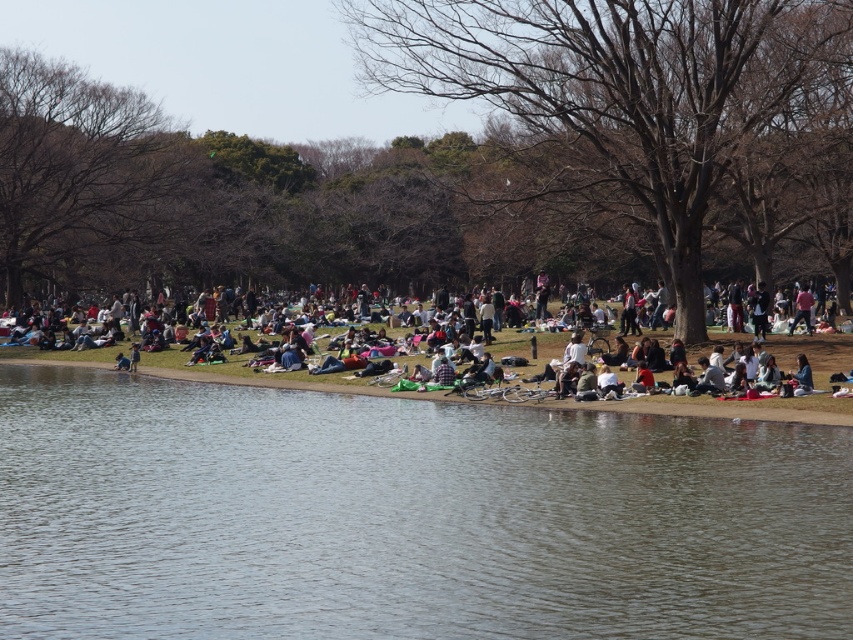
Question: Can you confirm if clear water at lower center is positioned above light brown fabric picnic blanket at center?

Choices:
 (A) no
 (B) yes

Answer: (A)

Question: Which object appears closest to the camera in this image?

Choices:
 (A) clear water at lower center
 (B) light brown fabric picnic blanket at center

Answer: (A)

Question: Is clear water at lower center positioned behind light brown fabric picnic blanket at center?

Choices:
 (A) no
 (B) yes

Answer: (A)

Question: Does clear water at lower center appear on the right side of light brown fabric picnic blanket at center?

Choices:
 (A) yes
 (B) no

Answer: (B)